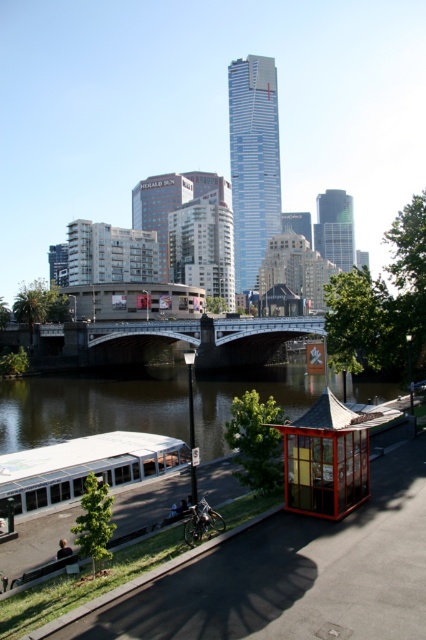
You are standing on the stone bridge in the scene and notice the brown water at lower center and the white matte boat at lower left. Which object is closer to your position on the bridge?

The white matte boat at lower left is closer to your position on the bridge because the brown water at lower center is below it, indicating the boat is situated above the water level near the bridge.

You are a tourist standing at the wooden bus stop at center, looking towards the river. Can you see the brown water at lower center from your current position?

Yes, the brown water at lower center is positioned under the wooden bus stop at center, so you can see it from your current position at the wooden bus stop at center.